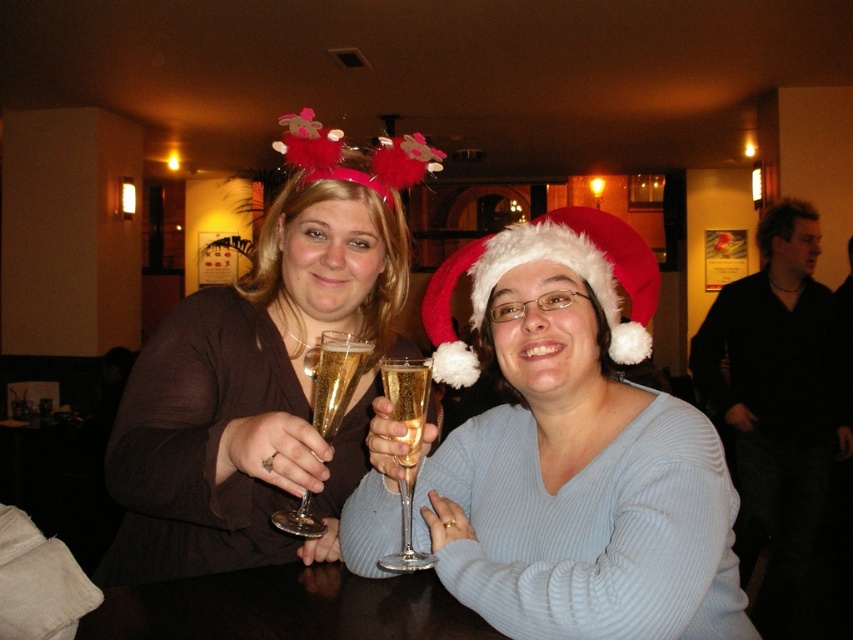
Question: Does light blue sweater at center appear under translucent glass champagne at center?

Choices:
 (A) no
 (B) yes

Answer: (B)

Question: Among these points, which one is nearest to the camera?

Choices:
 (A) pos(670,540)
 (B) pos(407,492)

Answer: (A)

Question: Can you confirm if light blue sweater at center is smaller than clear glass champagne flute at center?

Choices:
 (A) yes
 (B) no

Answer: (B)

Question: Which object appears closest to the camera in this image?

Choices:
 (A) light blue sweater at center
 (B) white fluffy santa hat at center
 (C) gold liquid champagne at center

Answer: (A)

Question: Where is light blue sweater at center located in relation to translucent glass champagne at center in the image?

Choices:
 (A) above
 (B) below

Answer: (B)

Question: Which object appears farthest from the camera in this image?

Choices:
 (A) matte black dress at center
 (B) clear glass champagne flute at center

Answer: (B)